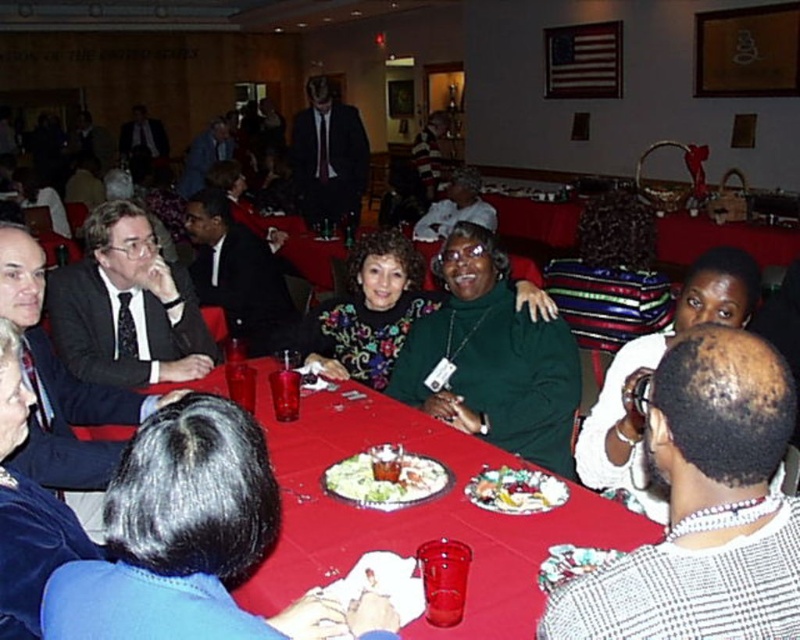
Is the position of matte black suit at center more distant than that of white plastic plate at center?

Yes, matte black suit at center is further from the viewer.

Describe the element at coordinates (329, 157) in the screenshot. The image size is (800, 640). I see `matte black suit at center` at that location.

Who is more distant from viewer, (322, 93) or (392, 483)?

Point (322, 93)

This screenshot has height=640, width=800. I want to click on matte black suit at center, so click(329, 157).

Is green velvet dress at center wider than striped sweater at upper center?

Yes.

Between point (421, 232) and point (433, 177), which one is positioned behind?

Positioned behind is point (433, 177).

The image size is (800, 640). Find the location of `green velvet dress at center`. green velvet dress at center is located at coordinates (454, 209).

Does matte black suit at left have a greater width compared to white plastic plate at center?

Correct, the width of matte black suit at left exceeds that of white plastic plate at center.

From the picture: Which is above, matte black suit at left or white plastic plate at center?

matte black suit at left

The image size is (800, 640). What are the coordinates of `matte black suit at left` in the screenshot? It's located at (126, 307).